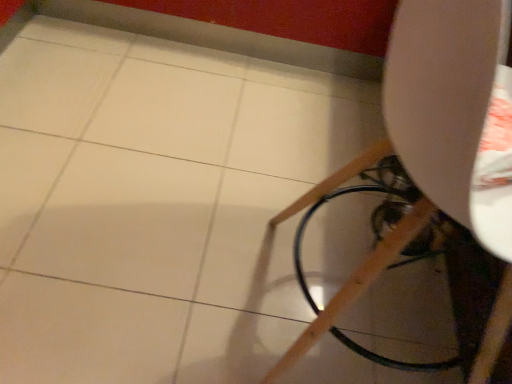
Locate an element on the screen. This screenshot has width=512, height=384. vacant region below matte white chair at right (from a real-world perspective) is located at coordinates (350, 317).